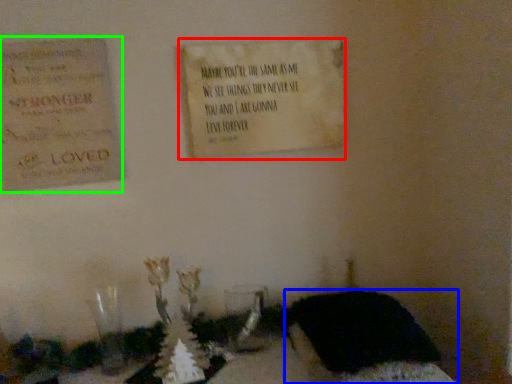
Question: Considering the real-world distances, which object is farthest from notice (highlighted by a red box)? furniture (highlighted by a blue box) or cardboard (highlighted by a green box)?

Choices:
 (A) furniture
 (B) cardboard

Answer: (A)